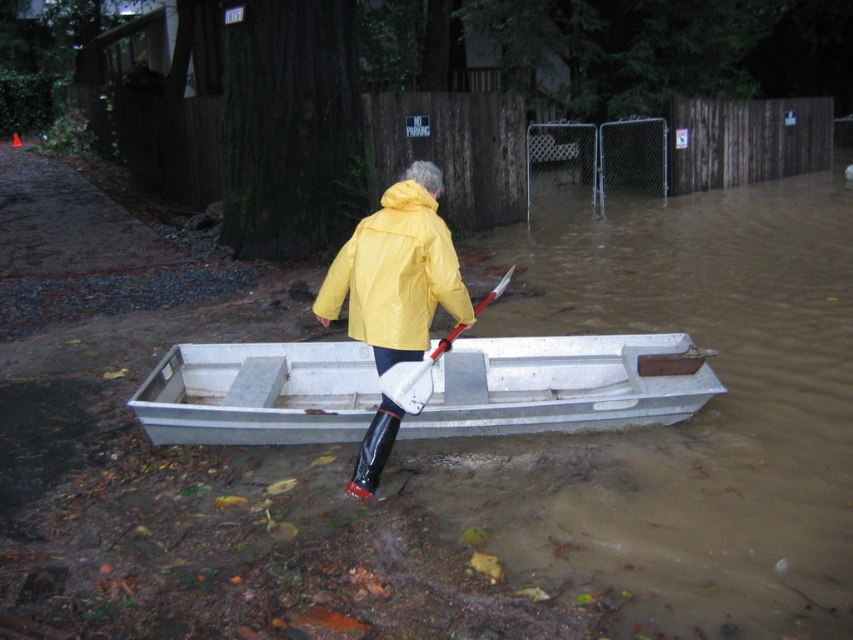
Question: Can you confirm if yellow matte jacket at center is positioned to the right of white plastic paddle at center?

Choices:
 (A) yes
 (B) no

Answer: (B)

Question: Does metallic gray boat at center appear under white plastic paddle at center?

Choices:
 (A) no
 (B) yes

Answer: (B)

Question: Is metallic gray boat at center to the left of white plastic paddle at center from the viewer's perspective?

Choices:
 (A) yes
 (B) no

Answer: (B)

Question: Considering the real-world distances, which object is closest to the metallic gray boat at center?

Choices:
 (A) yellow matte jacket at center
 (B) white plastic paddle at center

Answer: (A)

Question: Which point is closer to the camera?

Choices:
 (A) metallic gray boat at center
 (B) white plastic paddle at center
 (C) yellow matte jacket at center

Answer: (B)

Question: Among these objects, which one is nearest to the camera?

Choices:
 (A) yellow matte jacket at center
 (B) metallic gray boat at center
 (C) white plastic paddle at center

Answer: (C)